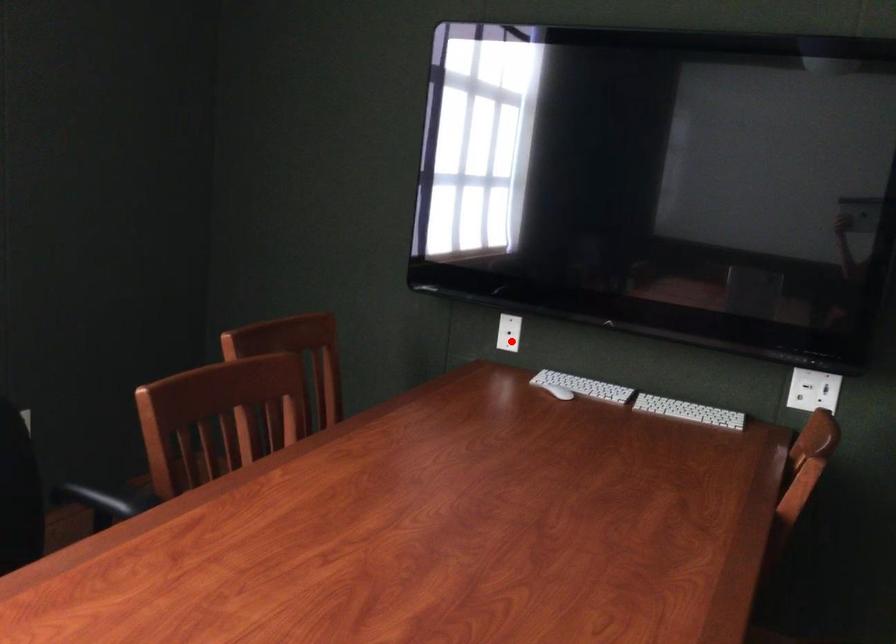
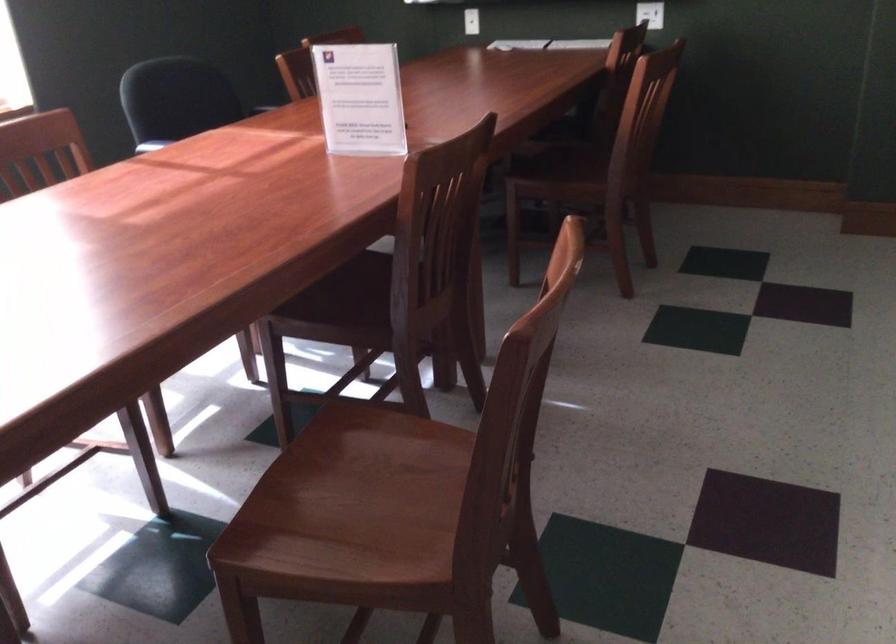
In the second image, find the point that corresponds to the highlighted location in the first image.

(471, 21)